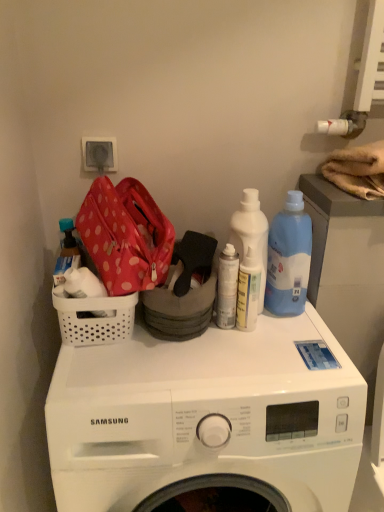
I want to click on vacant space in front of translucent plastic spray bottle at center, which is counted as the third cleaning product, starting from the right, so click(248, 367).